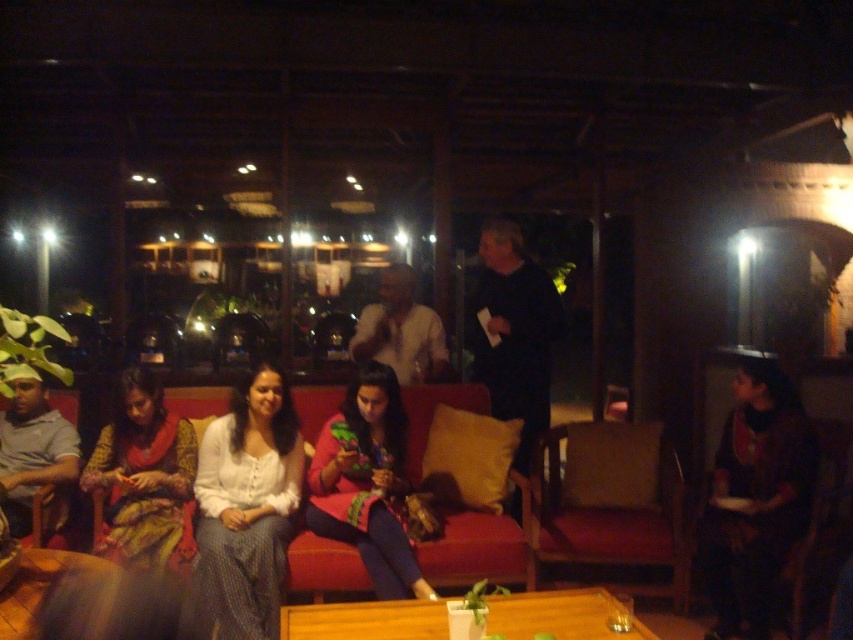
Question: Estimate the real-world distances between objects in this image. Which object is farther from the printed silk saree at center?

Choices:
 (A) multicolored fabric dress at center
 (B) wooden table at lower left
 (C) velvet red couch at center

Answer: (C)

Question: Can you confirm if velvet cushion at center is positioned above printed silk saree at center?

Choices:
 (A) no
 (B) yes

Answer: (A)

Question: Is multicolored fabric dress at center below printed silk saree at center?

Choices:
 (A) no
 (B) yes

Answer: (B)

Question: Does velvet red couch at center have a greater width compared to multicolored fabric dress at center?

Choices:
 (A) yes
 (B) no

Answer: (B)

Question: Which of the following is the closest to the observer?

Choices:
 (A) velvet red couch at center
 (B) printed silk saree at center
 (C) multicolored fabric dress at center
 (D) wooden table at center

Answer: (D)

Question: Among these objects, which one is nearest to the camera?

Choices:
 (A) multicolored fabric dress at center
 (B) printed silk saree at center
 (C) wooden table at center
 (D) velvet red couch at center

Answer: (C)